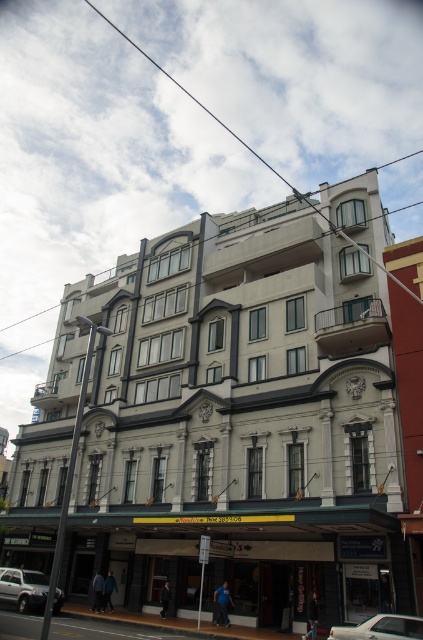
You are a pedestrian standing in front of the multi story building. You see a silver metallic car at lower left and a silver metallic sedan at center. Which one is closer to the ground floor entrance?

The silver metallic car at lower left is closer to the ground floor entrance because it is located below the silver metallic sedan at center.

You are a pedestrian standing on the sidewalk in front of the building. You see a silver metallic car at lower left and a silver metallic sedan at center. Which vehicle is closer to the left side of the street?

The silver metallic car at lower left is closer to the left side of the street because it is positioned to the left of the silver metallic sedan at center.